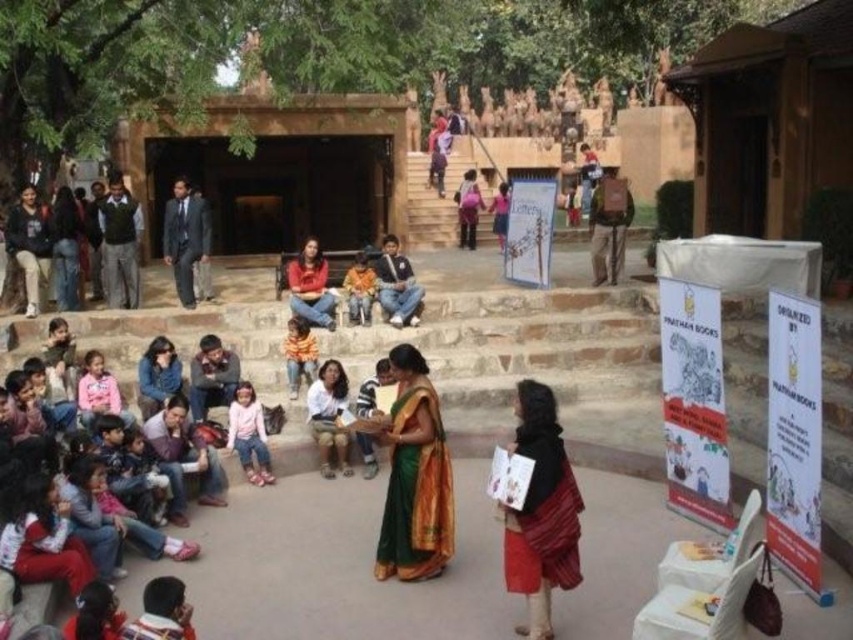
You are a photographer trying to capture a photo of both the green silk saree at center and the white cotton shirt at center. Which one should you focus on first if you want to include both in your frame without moving the camera?

You should focus on the white cotton shirt at center first because the green silk saree at center is to its right, so by centering the white cotton shirt, the green silk saree will naturally fall into the frame to its right side.

You are an observer looking at the scene. There are two people in the image wearing pink fabric pants at lower center and jeans at center. Which one is positioned to the left?

Answer: The pink fabric pants at lower center is to the left of jeans at center, so the person wearing pink fabric pants at lower center is positioned to the left.

You are a photographer trying to capture a photo of the denim jeans at center and the orange cotton shirt at center. Which one should you focus on first if you want to include both in your frame without moving the camera?

The orange cotton shirt at center should be focused on first because it is positioned to the left of the denim jeans at center, allowing the photographer to frame both objects by starting with the leftmost object.